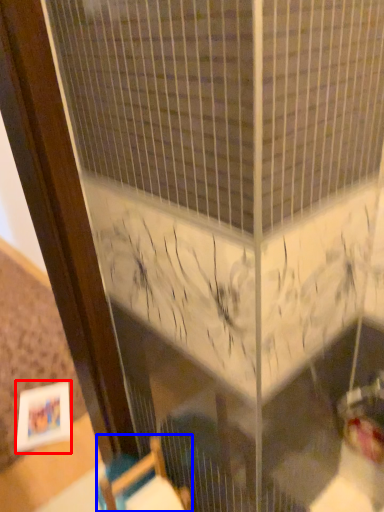
Question: Which object is further to the camera taking this photo, picture frame (highlighted by a red box) or furniture (highlighted by a blue box)?

Choices:
 (A) picture frame
 (B) furniture

Answer: (A)